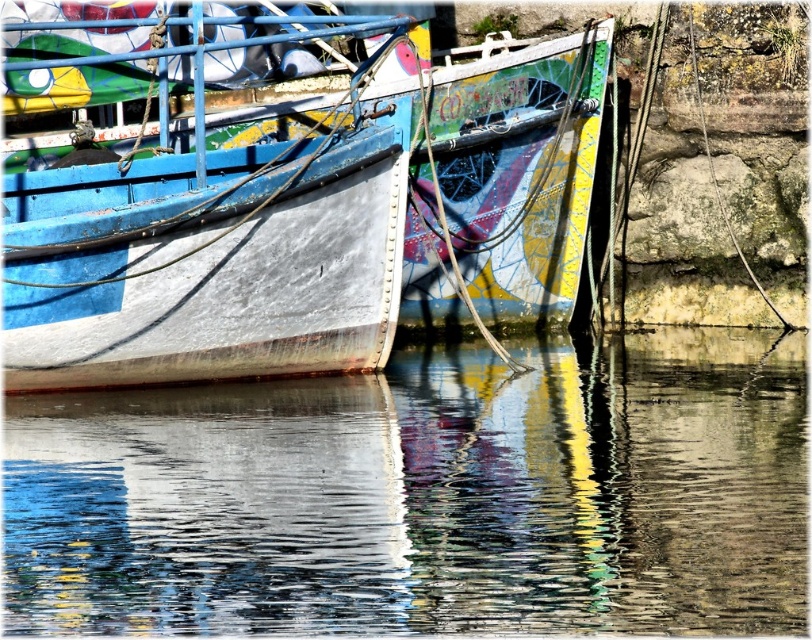
Is point (705, 381) closer to viewer compared to point (100, 232)?

No, (705, 381) is further to viewer.

Is point (16, 556) farther from viewer compared to point (327, 328)?

No, it is not.

Does point (408, 358) come farther from viewer compared to point (383, 353)?

That is True.

This screenshot has width=812, height=640. I want to click on glossy water at lower center, so click(x=424, y=497).